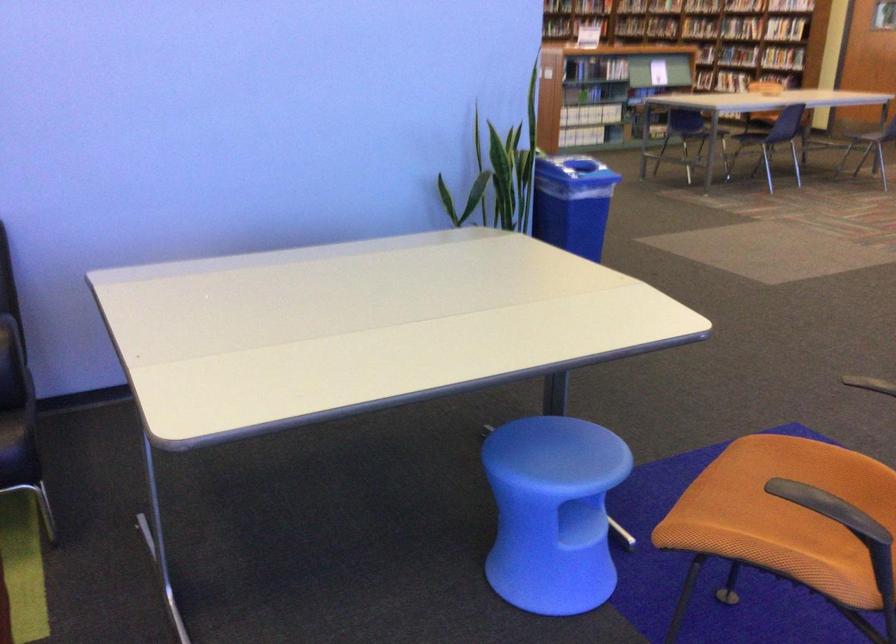
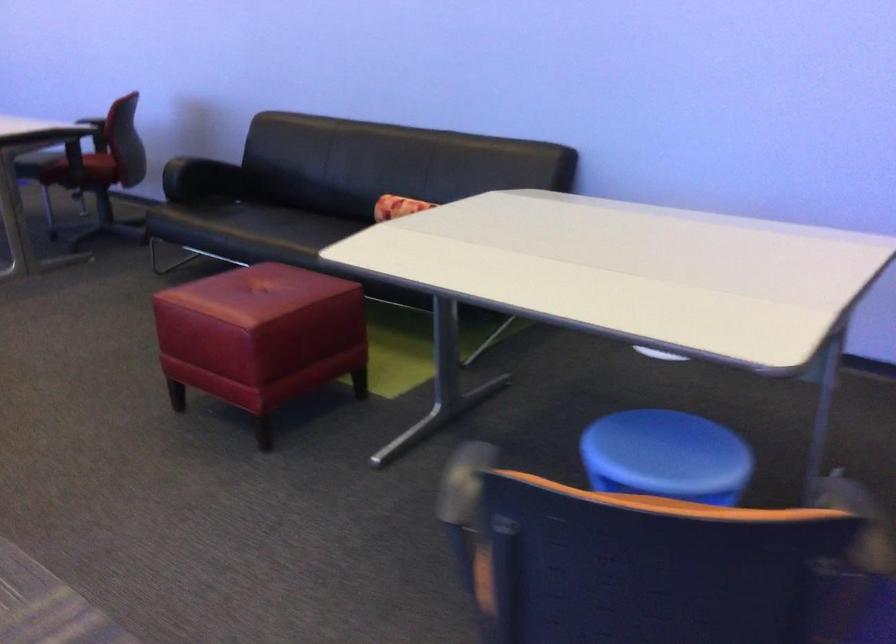
Question: I am providing you with two images of the same scene from different viewpoints. Please identify which objects are invisible in image2.

Choices:
 (A) black toothbrush cup
 (B) red leather ottoman
 (C) orange chair sitting surface
 (D) blue round stool

Answer: (C)